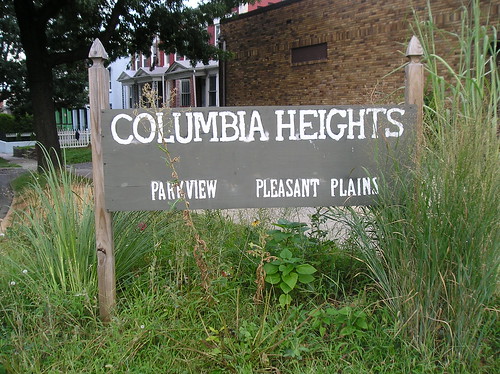
Image resolution: width=500 pixels, height=374 pixels. I want to click on brown wall, so (x=375, y=41), (x=365, y=61).